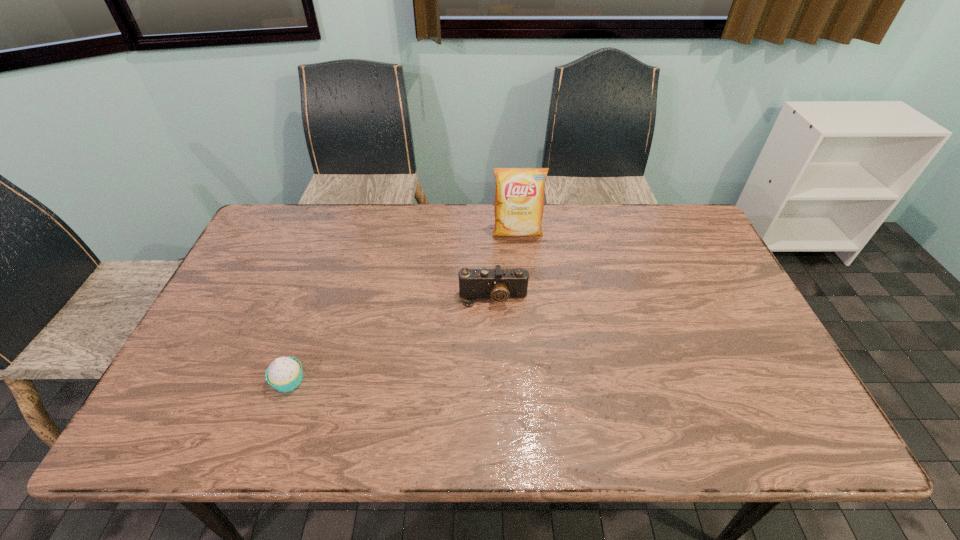
The width and height of the screenshot is (960, 540). In order to click on crisp (potato chip) in this screenshot , I will do `click(519, 196)`.

Identify the location of the tallest object. (519, 196).

I want to click on camera, so click(498, 284).

This screenshot has height=540, width=960. In order to click on cupcake in this screenshot , I will do `click(284, 374)`.

In order to click on the leftmost object in this screenshot , I will do `click(284, 374)`.

The width and height of the screenshot is (960, 540). What are the coordinates of `blank area located 0.250m on the front-facing side of the tallest object` in the screenshot? It's located at (524, 301).

Locate an element on the screen. This screenshot has width=960, height=540. free point located on the front-facing side of the camera is located at coordinates (494, 350).

Where is `free space located 0.150m on the left of the nearest object`? The image size is (960, 540). free space located 0.150m on the left of the nearest object is located at coordinates (209, 381).

Locate an element on the screen. The width and height of the screenshot is (960, 540). object that is at the far edge is located at coordinates (519, 196).

The height and width of the screenshot is (540, 960). In the image, there is a desktop. Identify the location of free space at the far edge. (578, 217).